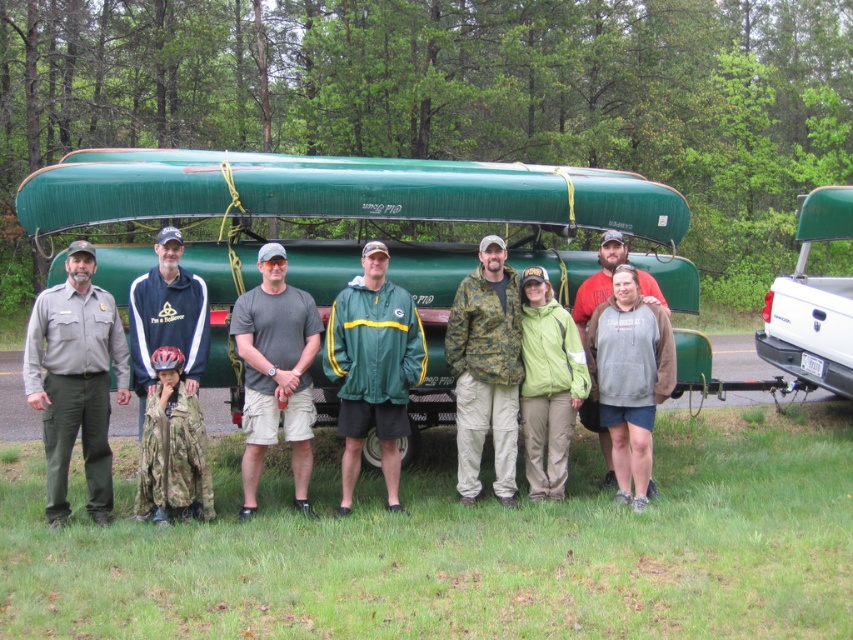
Looking at this image, is khaki uniform at left to the right of green matte jacket at center from the viewer's perspective?

No, khaki uniform at left is not to the right of green matte jacket at center.

Which is below, khaki uniform at left or green matte jacket at center?

khaki uniform at left

Which is in front, point (38, 326) or point (345, 397)?

Point (38, 326) is in front.

Find the location of a particular element. The width and height of the screenshot is (853, 640). khaki uniform at left is located at coordinates (74, 380).

Can you confirm if gray cotton t-shirt at center is positioned to the left of white matte truck at upper right?

Correct, you'll find gray cotton t-shirt at center to the left of white matte truck at upper right.

Which is in front, point (311, 413) or point (770, 289)?

Point (311, 413)

At what (x,y) coordinates should I click in order to perform the action: click on gray cotton t-shirt at center. Please return your answer as a coordinate pair (x, y). Looking at the image, I should click on (276, 372).

Where is `gray cotton t-shirt at center`? Image resolution: width=853 pixels, height=640 pixels. gray cotton t-shirt at center is located at coordinates (276, 372).

Between green matte boat at center and khaki uniform at left, which one has more height?

Standing taller between the two is khaki uniform at left.

Between point (218, 268) and point (122, 355), which one is positioned behind?

Point (218, 268)

Describe the element at coordinates (360, 227) in the screenshot. I see `green matte boat at center` at that location.

You are a GUI agent. You are given a task and a screenshot of the screen. Output one action in this format:
    pyautogui.click(x=<x>, y=<y>)
    Task: Click on the green matte boat at center
    
    Given the screenshot: What is the action you would take?
    pyautogui.click(x=360, y=227)